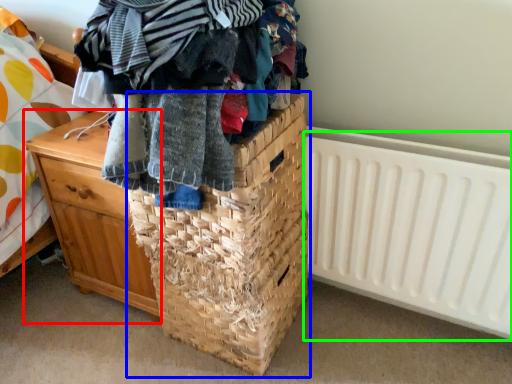
Question: Which object is positioned closest to chest of drawers (highlighted by a red box)? Select from basket (highlighted by a blue box) and radiator (highlighted by a green box).

Choices:
 (A) basket
 (B) radiator

Answer: (A)